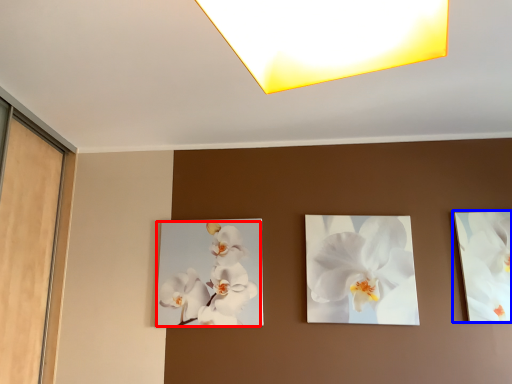
Question: Which object is closer to the camera taking this photo, flower (highlighted by a red box) or picture frame (highlighted by a blue box)?

Choices:
 (A) flower
 (B) picture frame

Answer: (B)